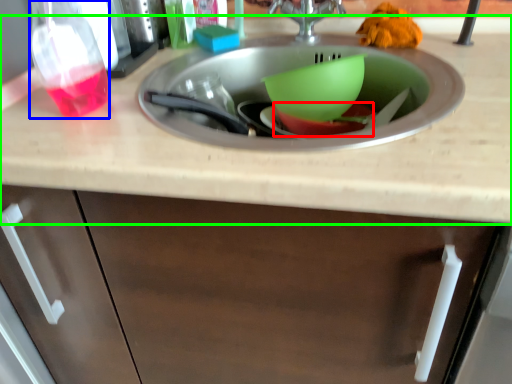
Question: Based on their relative distances, which object is nearer to basin (highlighted by a red box)? Choose from bottle (highlighted by a blue box) and countertop (highlighted by a green box).

Choices:
 (A) bottle
 (B) countertop

Answer: (B)